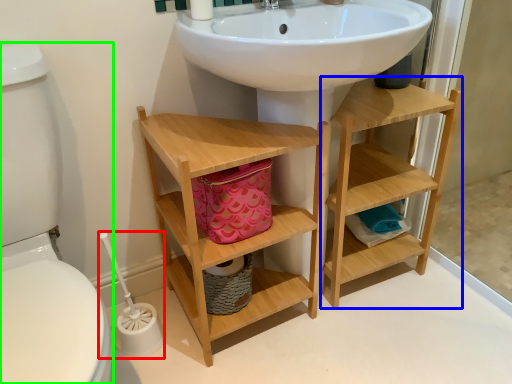
Question: Which object is positioned closest to brush (highlighted by a red box)? Select from shelf (highlighted by a blue box) and toilet bowl (highlighted by a green box).

Choices:
 (A) shelf
 (B) toilet bowl

Answer: (B)